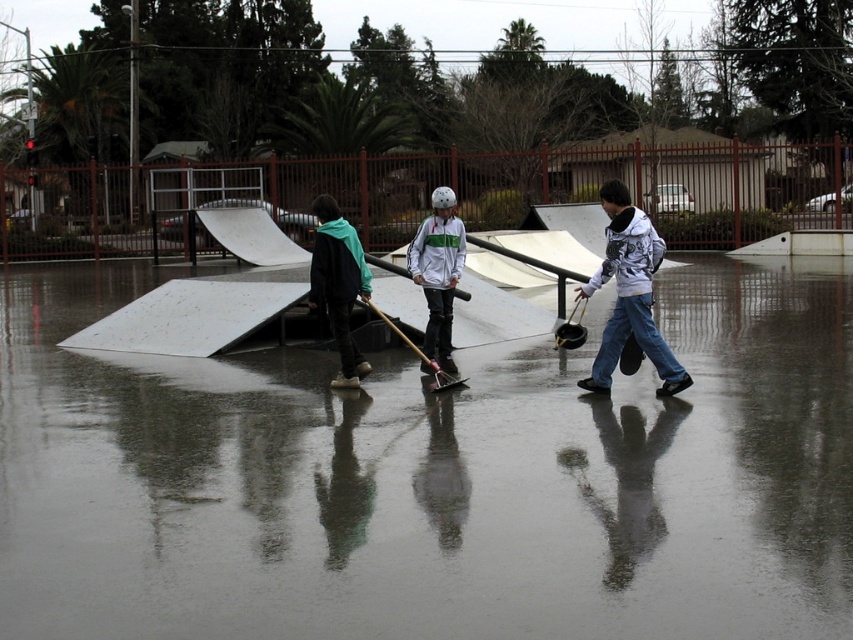
Question: Does white printed hoodie at center appear on the left side of white matte jacket at center?

Choices:
 (A) yes
 (B) no

Answer: (B)

Question: Which point is closer to the camera?

Choices:
 (A) (265, 525)
 (B) (437, 244)
 (C) (630, 204)

Answer: (A)

Question: Which of the following is the closest to the observer?

Choices:
 (A) (625, 282)
 (B) (155, 518)

Answer: (B)

Question: Is white matte jacket at center behind metallic silver skateboard at center?

Choices:
 (A) yes
 (B) no

Answer: (A)

Question: Does white matte jacket at center have a smaller size compared to metallic silver skateboard at center?

Choices:
 (A) no
 (B) yes

Answer: (B)

Question: Which point is closer to the camera?

Choices:
 (A) (334, 484)
 (B) (422, 348)
 (C) (619, 266)

Answer: (A)